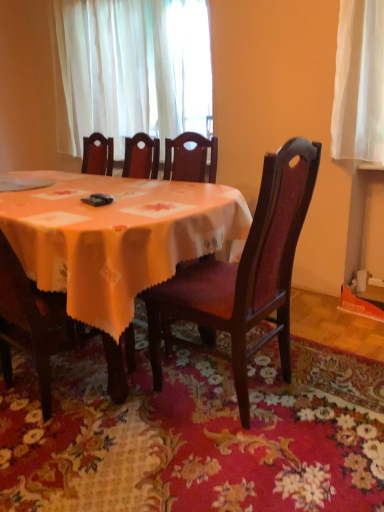
Question: Should I look upward or downward to see white sheer curtain at upper center?

Choices:
 (A) down
 (B) up

Answer: (B)

Question: Is the depth of matte wood chair at center, which is the first chair in right-to-left order, less than that of white glossy plate at upper left?

Choices:
 (A) yes
 (B) no

Answer: (A)

Question: Is matte wood chair at center, which appears as the second chair when viewed from the left, with white glossy plate at upper left?

Choices:
 (A) yes
 (B) no

Answer: (B)

Question: Does matte wood chair at center, which appears as the second chair when viewed from the left, have a lesser width compared to white glossy plate at upper left?

Choices:
 (A) no
 (B) yes

Answer: (A)

Question: Considering the relative sizes of matte wood chair at center, which is the first chair in right-to-left order, and white glossy plate at upper left in the image provided, is matte wood chair at center, which is the first chair in right-to-left order, smaller than white glossy plate at upper left?

Choices:
 (A) no
 (B) yes

Answer: (A)

Question: From the image's perspective, is matte wood chair at center, which is the first chair in right-to-left order, below white glossy plate at upper left?

Choices:
 (A) yes
 (B) no

Answer: (A)

Question: Is white glossy plate at upper left located within matte wood chair at center, which is the first chair in right-to-left order?

Choices:
 (A) yes
 (B) no

Answer: (B)

Question: Can you confirm if white sheer curtain at upper center is positioned to the right of matte orange tablecloth at center?

Choices:
 (A) no
 (B) yes

Answer: (B)

Question: Does white sheer curtain at upper center come in front of matte orange tablecloth at center?

Choices:
 (A) no
 (B) yes

Answer: (A)

Question: Considering the relative sizes of white sheer curtain at upper center and matte orange tablecloth at center in the image provided, is white sheer curtain at upper center shorter than matte orange tablecloth at center?

Choices:
 (A) yes
 (B) no

Answer: (B)

Question: Is white sheer curtain at upper center to the left of matte orange tablecloth at center from the viewer's perspective?

Choices:
 (A) yes
 (B) no

Answer: (B)

Question: Is white sheer curtain at upper center wider than matte orange tablecloth at center?

Choices:
 (A) no
 (B) yes

Answer: (A)

Question: From a real-world perspective, is white sheer curtain at upper center located beneath matte orange tablecloth at center?

Choices:
 (A) yes
 (B) no

Answer: (B)

Question: Can you confirm if matte wood chair at center, which is the first chair in right-to-left order, is smaller than matte orange tablecloth at center?

Choices:
 (A) no
 (B) yes

Answer: (B)